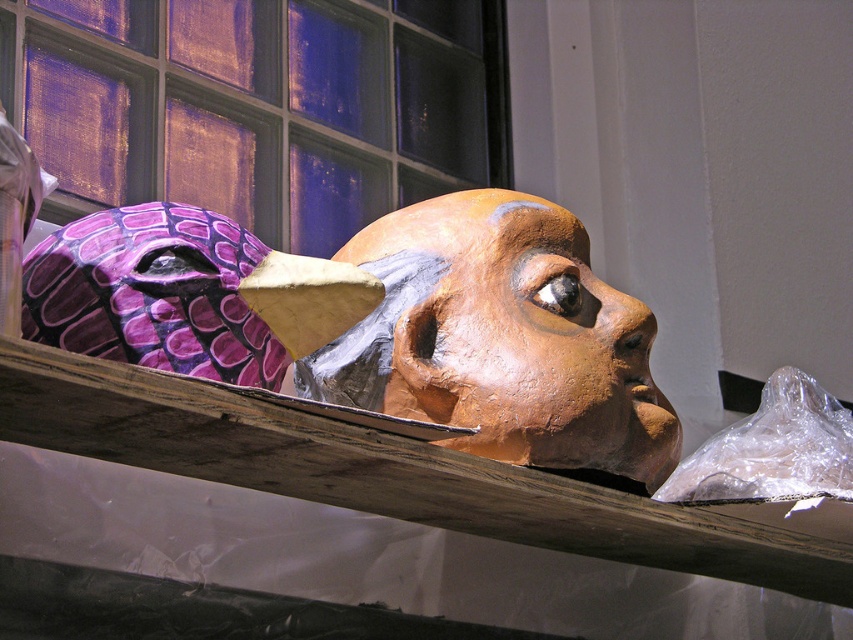
You are an art student analyzing the sculpture. You notice two points on the sculpture marked as point 1 at coordinates (x=614, y=412) and point 2 at (x=589, y=323). Which point is closer to your viewpoint?

Point 1 at coordinates (x=614, y=412) is closer to the camera than point 2 at (x=589, y=323).

You are an art student analyzing the sculpture. You notice the blue glass window at upper center and the matte brown mask at center. According to the composition, which object is positioned to the left of the other?

The blue glass window at upper center is positioned to the left of the matte brown mask at center.